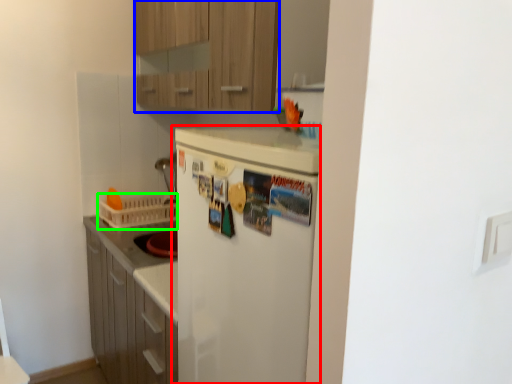
Question: Which is nearer to the refrigerator (highlighted by a red box)? cabinetry (highlighted by a blue box) or basket (highlighted by a green box).

Choices:
 (A) cabinetry
 (B) basket

Answer: (A)